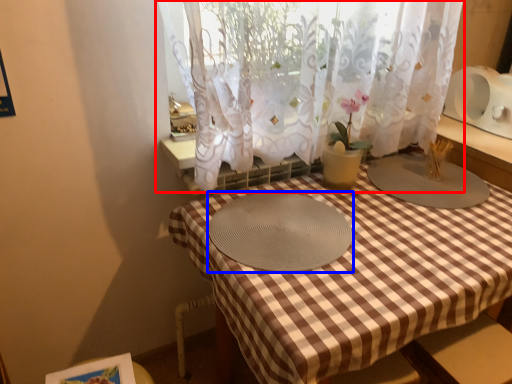
Question: Which of the following is the farthest to the observer, curtain (highlighted by a red box) or glass plate (highlighted by a blue box)?

Choices:
 (A) curtain
 (B) glass plate

Answer: (B)